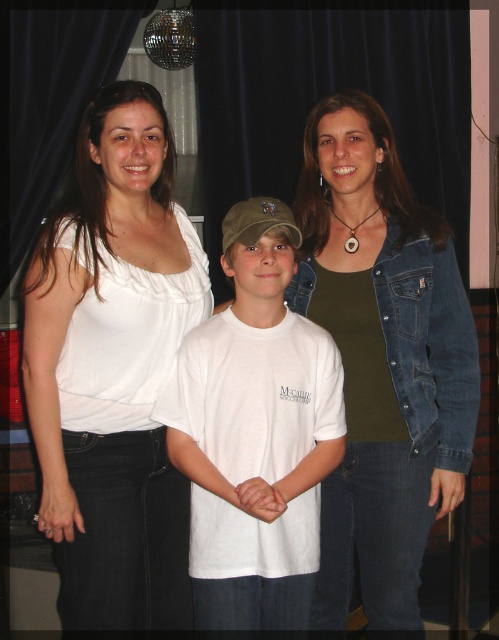
Looking at this image, who is positioned more to the left, white cotton blouse at upper left or denim jacket at right?

Positioned to the left is white cotton blouse at upper left.

Measure the distance between white cotton blouse at upper left and camera.

A distance of 5.50 feet exists between white cotton blouse at upper left and camera.

Image resolution: width=499 pixels, height=640 pixels. What do you see at coordinates (112, 369) in the screenshot?
I see `white cotton blouse at upper left` at bounding box center [112, 369].

Find the location of a particular element. The width and height of the screenshot is (499, 640). white cotton blouse at upper left is located at coordinates (112, 369).

Is point (144, 128) positioned before point (332, 422)?

Yes, point (144, 128) is closer to viewer.

Which is in front, point (171, 348) or point (276, 609)?

Point (276, 609)

At what (x,y) coordinates should I click in order to perform the action: click on white cotton blouse at upper left. Please return your answer as a coordinate pair (x, y). Image resolution: width=499 pixels, height=640 pixels. Looking at the image, I should click on (112, 369).

Does point (385, 496) come farther from viewer compared to point (283, 525)?

Yes, it is behind point (283, 525).

Is point (358, 413) positioned before point (266, 394)?

No, it is behind (266, 394).

Where is `denim jacket at right`? denim jacket at right is located at coordinates (383, 358).